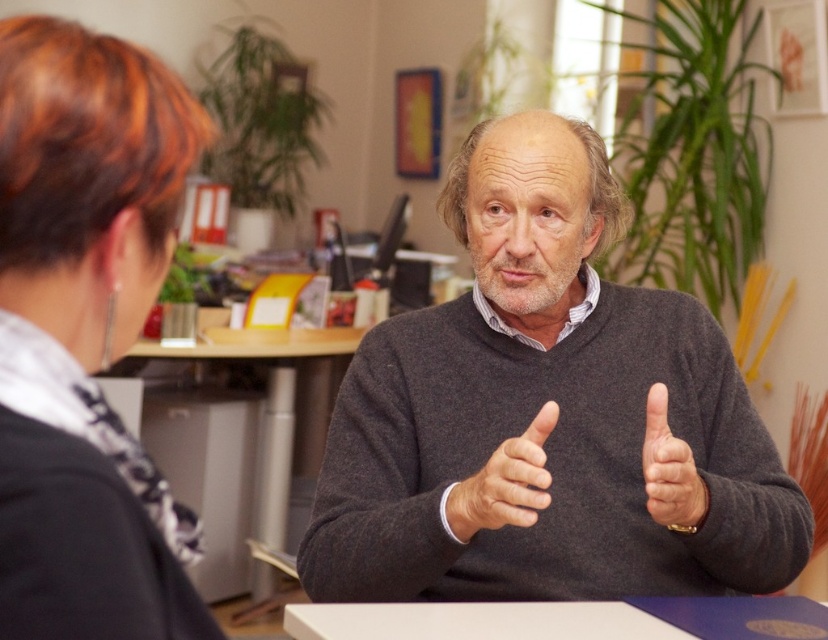
Question: Does black fabric hair at upper left have a smaller size compared to brown leather hand at center?

Choices:
 (A) no
 (B) yes

Answer: (A)

Question: Estimate the real-world distances between objects in this image. Which object is farther from the dark gray sweater at center?

Choices:
 (A) white matte table at center
 (B) brown leather hand at center
 (C) black fabric hair at upper left

Answer: (C)

Question: Can you confirm if dark gray sweater at center is wider than gray matte hand at center?

Choices:
 (A) yes
 (B) no

Answer: (A)

Question: Which point is closer to the camera?

Choices:
 (A) (663, 410)
 (B) (51, 595)

Answer: (B)

Question: Does black fabric hair at upper left appear on the right side of brown leather hand at center?

Choices:
 (A) yes
 (B) no

Answer: (B)

Question: Estimate the real-world distances between objects in this image. Which object is closer to the black fabric hair at upper left?

Choices:
 (A) brown leather hand at center
 (B) gray matte hand at center
 (C) dark gray sweater at center

Answer: (A)